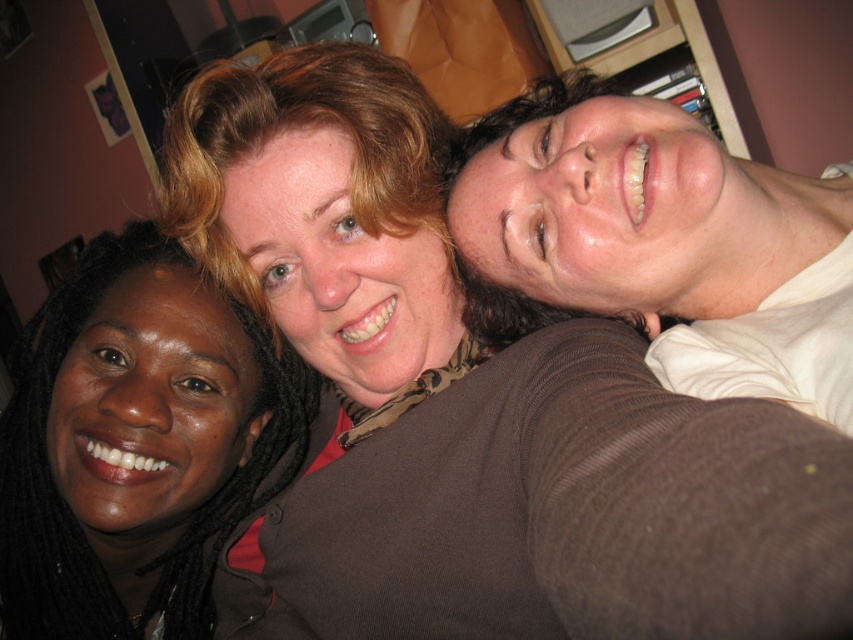
Can you confirm if matte brown sweater at upper left is thinner than matte brown sweater at upper right?

Indeed, matte brown sweater at upper left has a lesser width compared to matte brown sweater at upper right.

Between matte brown sweater at upper left and matte brown sweater at upper right, which one appears on the left side from the viewer's perspective?

Positioned to the left is matte brown sweater at upper left.

The width and height of the screenshot is (853, 640). Identify the location of matte brown sweater at upper left. (136, 444).